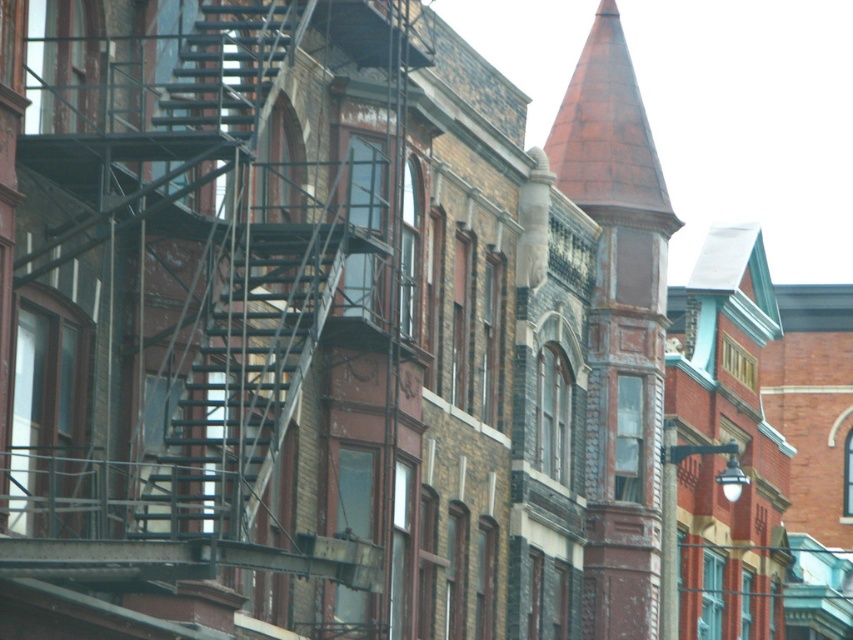
Question: Which of these objects is positioned closest to the metallic fire escape at center?

Choices:
 (A) rusty metal spire at center
 (B) metallic fire escape at left

Answer: (B)

Question: Estimate the real-world distances between objects in this image. Which object is farther from the metallic fire escape at center?

Choices:
 (A) rusty metal spire at center
 (B) metallic fire escape at left

Answer: (A)

Question: Estimate the real-world distances between objects in this image. Which object is closer to the metallic fire escape at left?

Choices:
 (A) metallic fire escape at center
 (B) rusty metal spire at center

Answer: (A)

Question: Is metallic fire escape at left bigger than rusty metal spire at center?

Choices:
 (A) no
 (B) yes

Answer: (B)

Question: Is the position of rusty metal spire at center less distant than that of metallic fire escape at center?

Choices:
 (A) yes
 (B) no

Answer: (B)

Question: Is metallic fire escape at left to the left of metallic fire escape at center from the viewer's perspective?

Choices:
 (A) yes
 (B) no

Answer: (B)